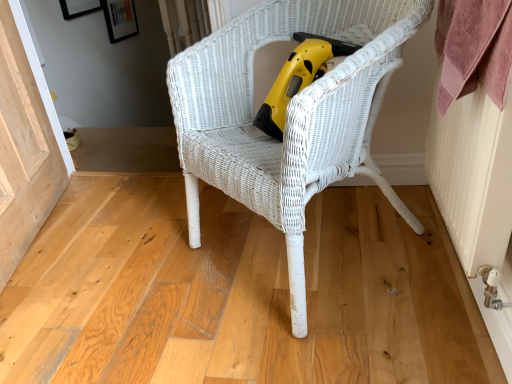
This screenshot has width=512, height=384. I want to click on free space between white wicker chair at center and natural wood screen door at lower left, so click(x=128, y=252).